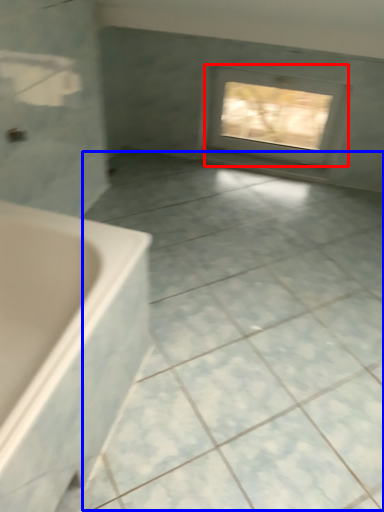
Question: Among these objects, which one is farthest to the camera, window (highlighted by a red box) or ceramic tile (highlighted by a blue box)?

Choices:
 (A) window
 (B) ceramic tile

Answer: (A)